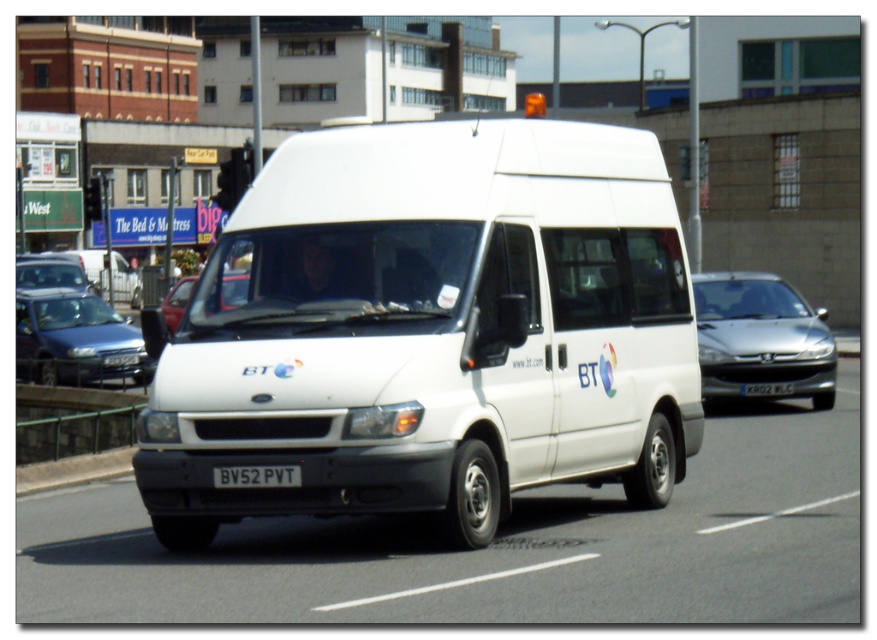
You are a pedestrian standing on the sidewalk and see the matte silver car at left and the matte red car at center. Which car is closer to you?

The matte silver car at left is closer to you because it is positioned further to the viewer than the matte red car at center.

Based on the photo, what is the color of the vehicle at the point indicated by the coordinates (x=761, y=337)?

The point at coordinates (x=761, y=337) indicates a silver metallic sedan at right, so the color is silver.

Consider the image. You are a pedestrian standing on the sidewalk and see the matte red car at center and the white plastic license plate at center. Which object is closer to you?

The matte red car at center is closer to you because it is positioned over the white plastic license plate at center, indicating it is in front of it.